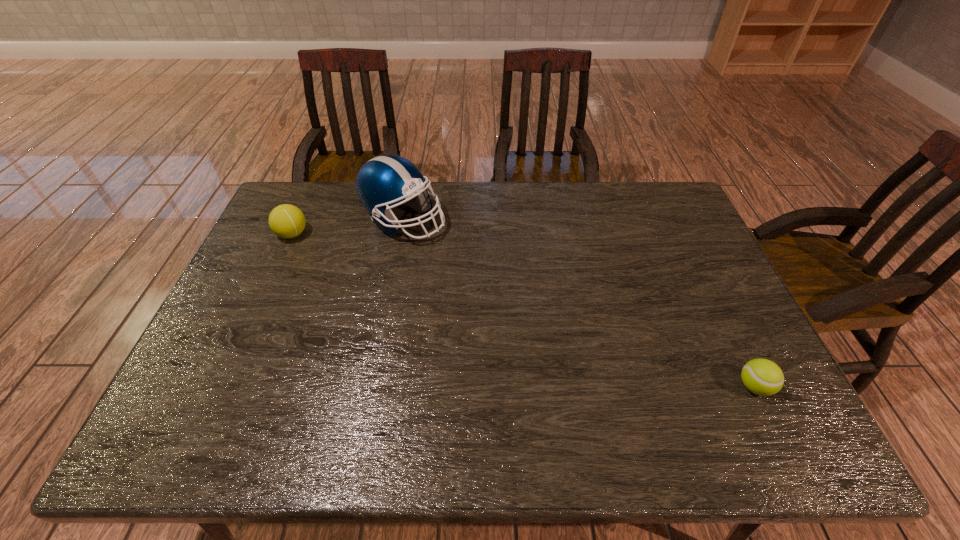
Identify the location of football helmet. This screenshot has height=540, width=960. (384, 182).

Image resolution: width=960 pixels, height=540 pixels. In order to click on the second object from left to right in this screenshot , I will do click(384, 182).

You are a GUI agent. You are given a task and a screenshot of the screen. Output one action in this format:
    pyautogui.click(x=<x>, y=<y>)
    Task: Click on the left tennis ball
    
    Given the screenshot: What is the action you would take?
    pyautogui.click(x=287, y=221)

You are a GUI agent. You are given a task and a screenshot of the screen. Output one action in this format:
    pyautogui.click(x=<x>, y=<y>)
    Task: Click on the farther tennis ball
    The width and height of the screenshot is (960, 540).
    Given the screenshot: What is the action you would take?
    pyautogui.click(x=287, y=221)

Where is `the rightmost object`? The image size is (960, 540). the rightmost object is located at coordinates (763, 377).

The image size is (960, 540). I want to click on the shorter tennis ball, so click(x=763, y=377).

Locate an element on the screen. This screenshot has width=960, height=540. free space located at the front of the football helmet with the faceguard is located at coordinates (462, 221).

This screenshot has height=540, width=960. Find the location of `vacant space located 0.270m on the right of the left tennis ball`. vacant space located 0.270m on the right of the left tennis ball is located at coordinates (393, 234).

Find the location of a particular element. vacant area located 0.380m on the back of the nearest object is located at coordinates (694, 262).

What are the coordinates of `object that is positioned at the far edge` in the screenshot? It's located at (384, 182).